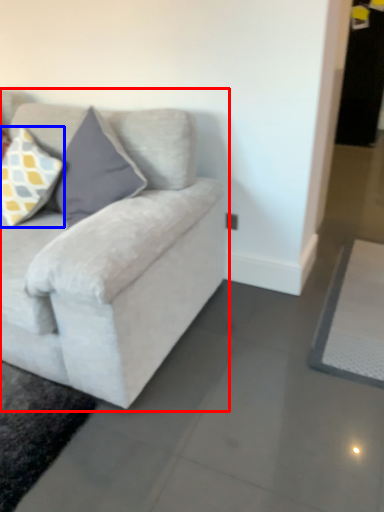
Question: Among these objects, which one is farthest to the camera, studio couch (highlighted by a red box) or pillow (highlighted by a blue box)?

Choices:
 (A) studio couch
 (B) pillow

Answer: (B)